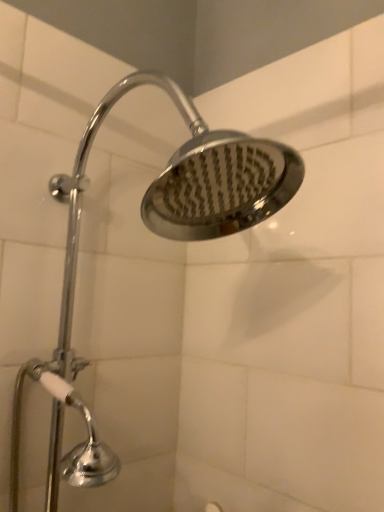
Question: Which direction should I rotate to look at polished chrome shower head at upper center?

Choices:
 (A) right
 (B) left

Answer: (B)